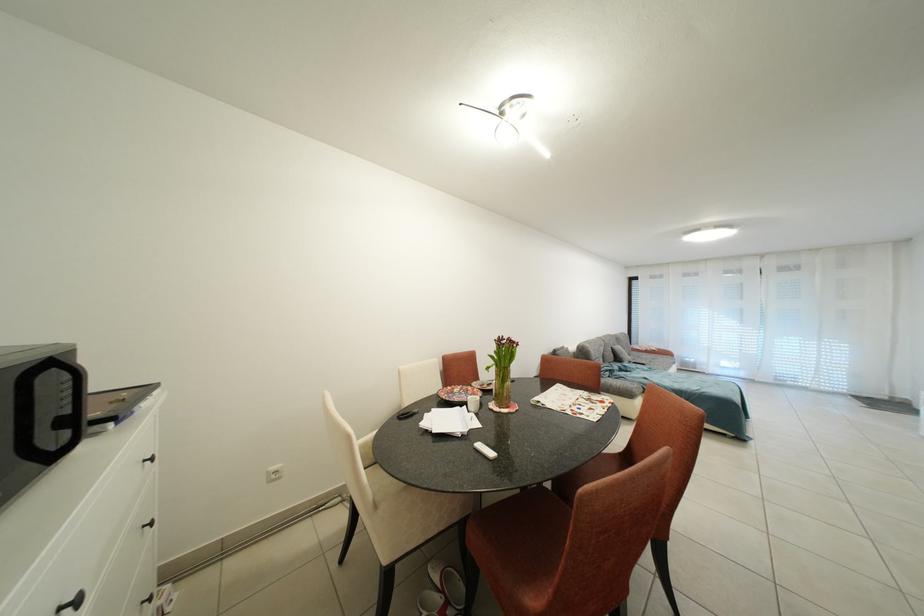
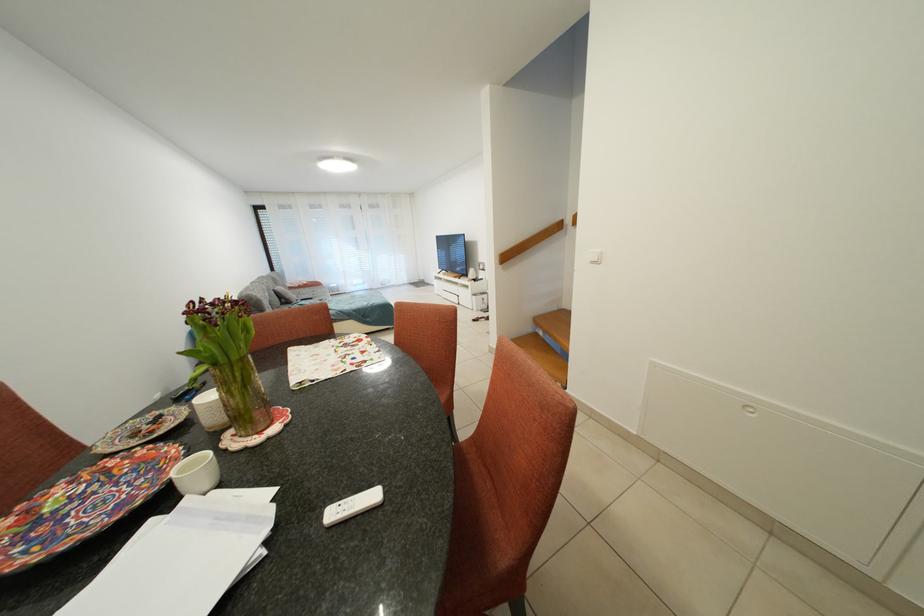
Locate, in the second image, the point that corresponds to point (749, 378) in the first image.

(373, 291)